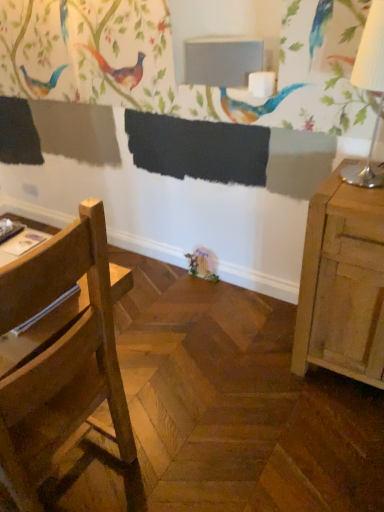
Question: In terms of size, does white paper lampshade at right appear bigger or smaller than matte gray table at upper center?

Choices:
 (A) small
 (B) big

Answer: (B)

Question: Is point (360, 67) closer or farther from the camera than point (244, 35)?

Choices:
 (A) farther
 (B) closer

Answer: (B)

Question: Estimate the real-world distances between objects in this image. Which object is closer to the white paper lampshade at right?

Choices:
 (A) matte gray table at upper center
 (B) wooden chair at left

Answer: (A)

Question: Which of these objects is positioned closest to the wooden chair at left?

Choices:
 (A) matte gray table at upper center
 (B) white paper lampshade at right

Answer: (B)